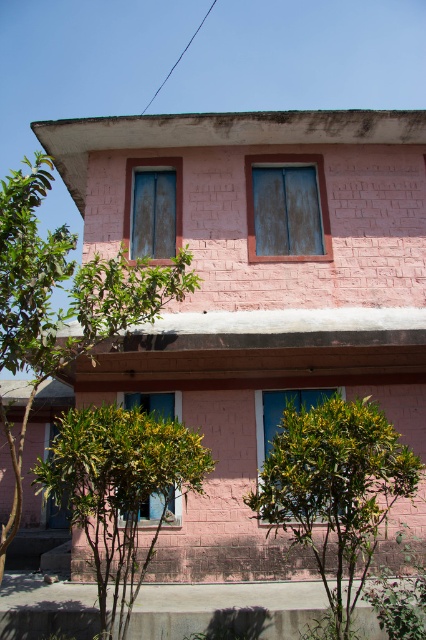
You are an architect designing a new building and want to ensure proper ventilation. You notice the blue matte window at center and the blue glass window at lower left. Which window should you consider for installing a ventilation system that requires more vertical space?

The blue matte window at center is taller than the blue glass window at lower left, so it would be better to install the ventilation system requiring more vertical space there.